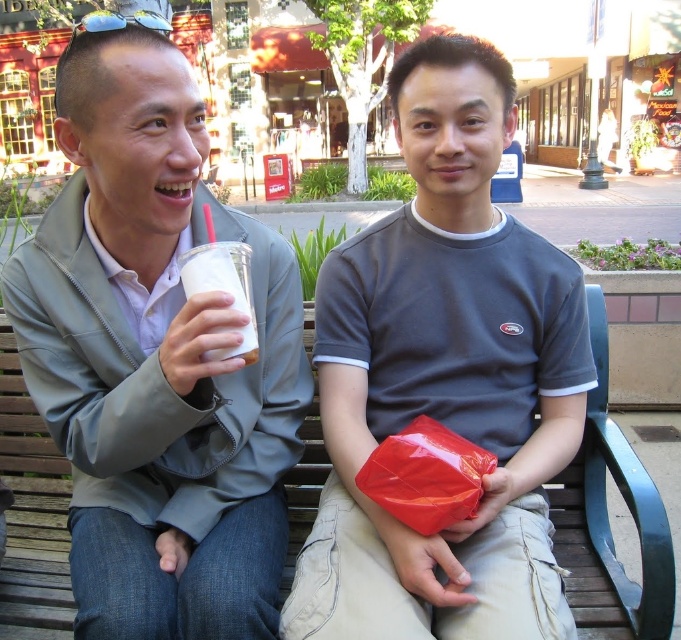
Question: Which object is the closest to the white plastic cup at left?

Choices:
 (A) matte gray shirt at center
 (B) matte plastic cup at left

Answer: (B)

Question: From the image, what is the correct spatial relationship of matte gray shirt at center in relation to white plastic cup at left?

Choices:
 (A) right
 (B) left

Answer: (A)

Question: Does matte plastic cup at left come behind white plastic cup at left?

Choices:
 (A) no
 (B) yes

Answer: (A)

Question: Does matte gray shirt at center come in front of white plastic cup at left?

Choices:
 (A) no
 (B) yes

Answer: (B)

Question: Which of the following is the farthest from the observer?

Choices:
 (A) (138, 385)
 (B) (227, 241)

Answer: (B)

Question: Which of the following is the farthest from the observer?

Choices:
 (A) white plastic cup at left
 (B) matte gray shirt at center

Answer: (A)